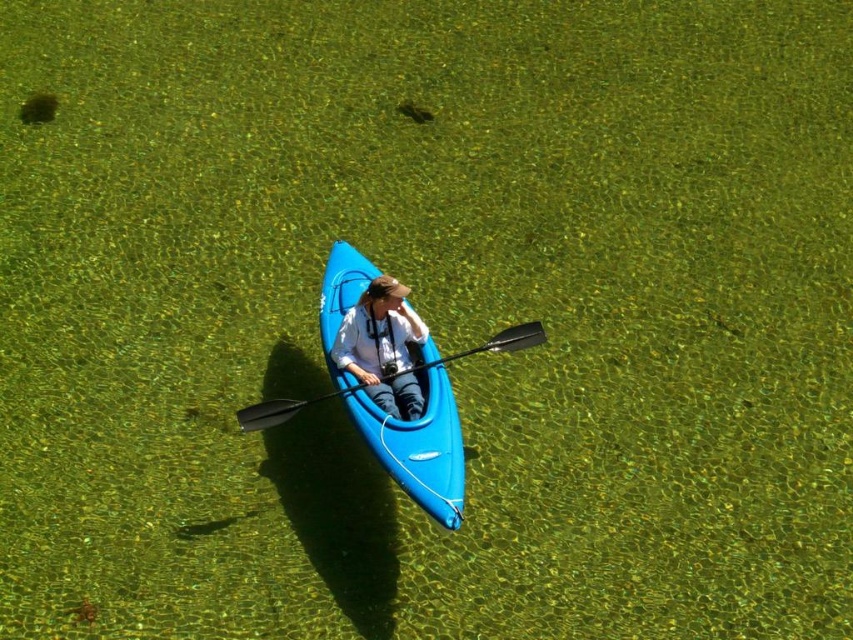
Question: Is white fabric person at center wider than black plastic paddle at center?

Choices:
 (A) yes
 (B) no

Answer: (B)

Question: Among these points, which one is nearest to the camera?

Choices:
 (A) (299, 403)
 (B) (424, 432)
 (C) (405, 392)

Answer: (B)

Question: Which object appears closest to the camera in this image?

Choices:
 (A) white fabric person at center
 (B) blue plastic canoe at center
 (C) black plastic paddle at center

Answer: (B)

Question: Is the position of blue plastic canoe at center more distant than that of black plastic paddle at center?

Choices:
 (A) no
 (B) yes

Answer: (A)

Question: Does blue plastic canoe at center lie behind black plastic paddle at center?

Choices:
 (A) yes
 (B) no

Answer: (B)

Question: Estimate the real-world distances between objects in this image. Which object is closer to the blue plastic canoe at center?

Choices:
 (A) black plastic paddle at center
 (B) white fabric person at center

Answer: (B)